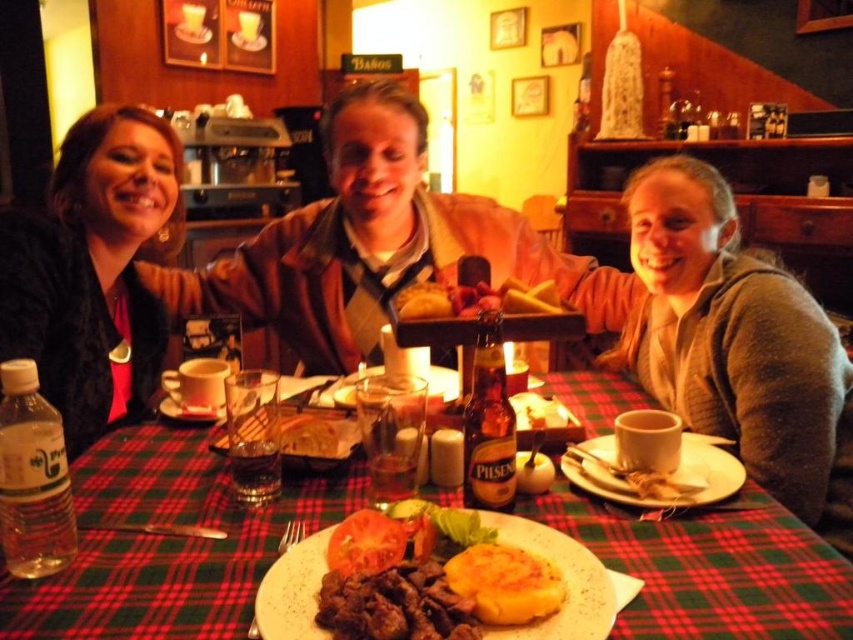
Question: In this image, where is matte black jacket at left located relative to golden-brown crusty bread at center?

Choices:
 (A) above
 (B) below

Answer: (A)

Question: Considering the real-world distances, which object is closest to the golden brown bread at center?

Choices:
 (A) matte brown jacket at center
 (B) matte black jacket at left
 (C) golden crispy bread at center
 (D) golden-brown crusty bread at center

Answer: (D)

Question: Does matte black jacket at left have a greater width compared to golden brown bread at center?

Choices:
 (A) yes
 (B) no

Answer: (A)

Question: Which is farther from the green plaid tablecloth at center?

Choices:
 (A) golden-brown crusty bread at center
 (B) golden crispy hash brown at center
 (C) golden crispy bread at center
 (D) white ceramic plate at center

Answer: (B)

Question: Which object appears closest to the camera in this image?

Choices:
 (A) golden brown bread at center
 (B) white ceramic plate at center
 (C) matte brown jacket at center

Answer: (B)

Question: Is green plaid tablecloth at center to the left of matte black jacket at left from the viewer's perspective?

Choices:
 (A) no
 (B) yes

Answer: (A)